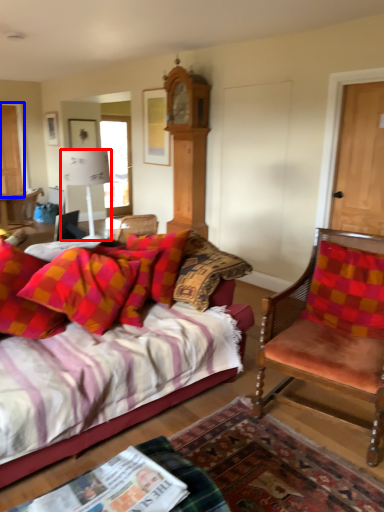
Question: Which point is closer to the camera, lamp (highlighted by a red box) or door (highlighted by a blue box)?

Choices:
 (A) lamp
 (B) door

Answer: (A)